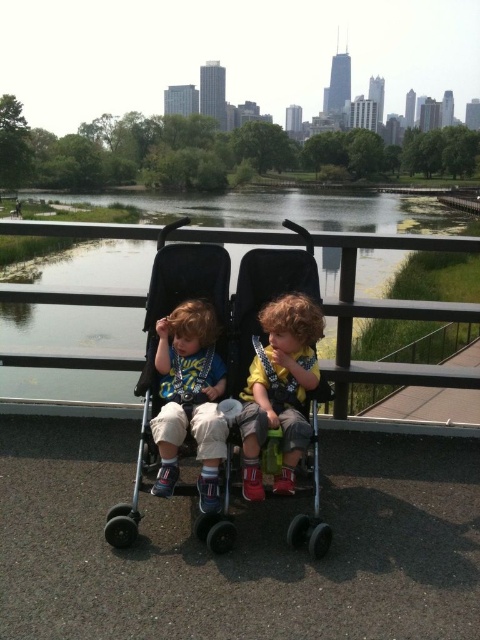
Does green grass at lower center have a greater width compared to black plastic stroller at center?

Yes, green grass at lower center is wider than black plastic stroller at center.

Is green grass at lower center shorter than black plastic stroller at center?

No.

The image size is (480, 640). Describe the element at coordinates (332, 243) in the screenshot. I see `green grass at lower center` at that location.

Locate an element on the screen. This screenshot has width=480, height=640. green grass at lower center is located at coordinates (332, 243).

Is black plastic stroller at center to the right of yellow cotton shirt at center from the viewer's perspective?

Incorrect, black plastic stroller at center is not on the right side of yellow cotton shirt at center.

You are a GUI agent. You are given a task and a screenshot of the screen. Output one action in this format:
    pyautogui.click(x=<x>, y=<y>)
    Task: Click on the black plastic stroller at center
    The width and height of the screenshot is (480, 640).
    Given the screenshot: What is the action you would take?
    pyautogui.click(x=219, y=332)

How distant is green grass at lower center from yellow cotton shirt at center?

green grass at lower center and yellow cotton shirt at center are 13.98 meters apart from each other.

Is green grass at lower center thinner than yellow cotton shirt at center?

No, green grass at lower center is not thinner than yellow cotton shirt at center.

Is point (36, 384) positioned in front of point (252, 484)?

No, (36, 384) is further to viewer.

The height and width of the screenshot is (640, 480). In order to click on green grass at lower center in this screenshot , I will do `click(332, 243)`.